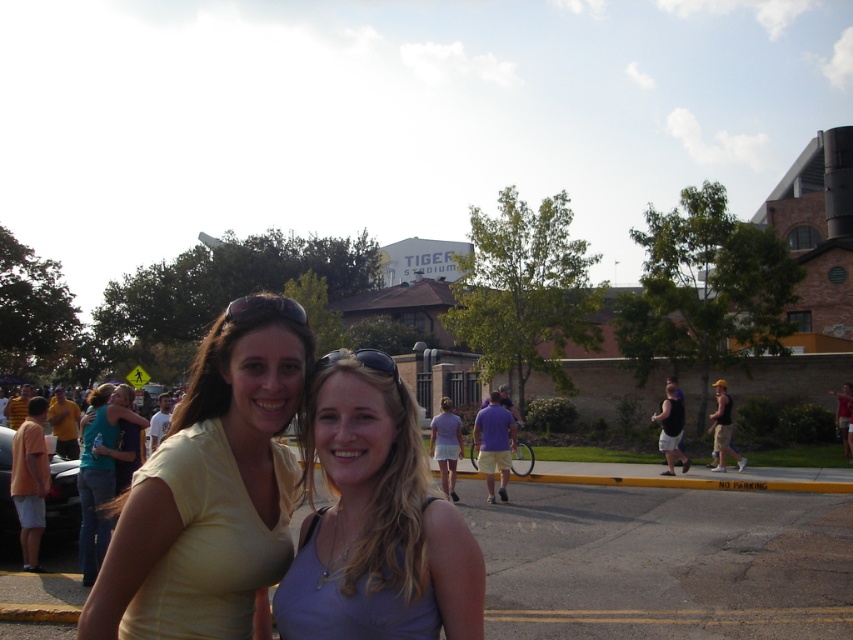
Who is taller, yellow matte shirt at center or purple matte tank top at center?

yellow matte shirt at center

Between point (210, 472) and point (370, 499), which one is positioned behind?

Positioned behind is point (210, 472).

Where is `yellow matte shirt at center`? yellow matte shirt at center is located at coordinates (212, 488).